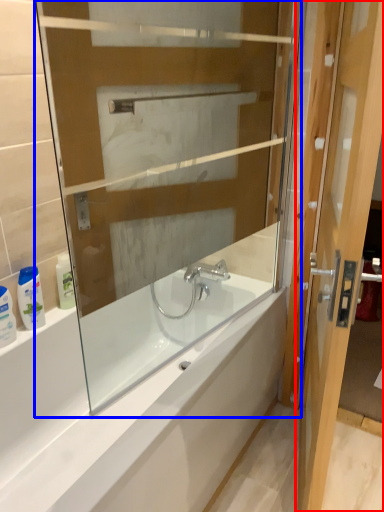
Question: Which of the following is the closest to the observer, door (highlighted by a red box) or glass box (highlighted by a blue box)?

Choices:
 (A) door
 (B) glass box

Answer: (A)